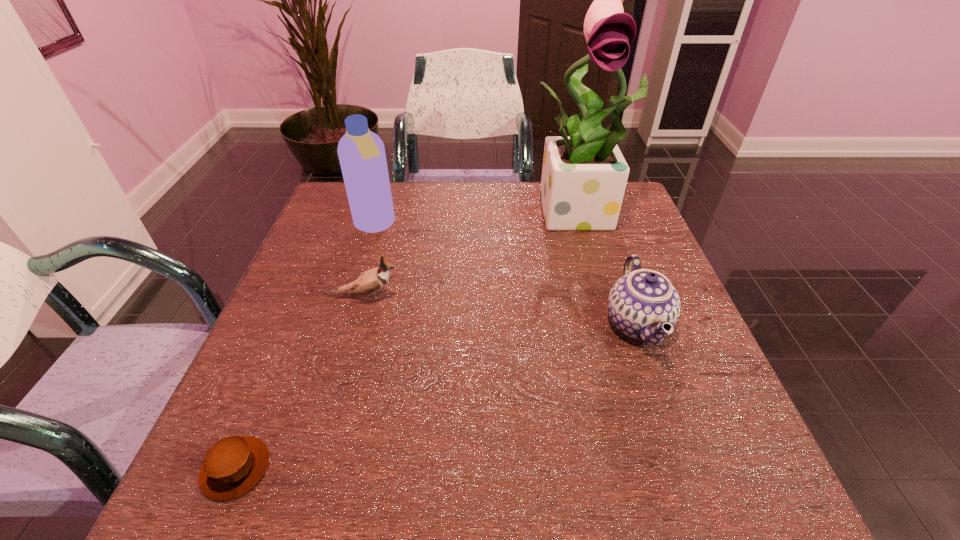
I want to click on free space located at the spout of the chinaware, so click(x=472, y=323).

What are the coordinates of `free space located at the face of the bird` in the screenshot? It's located at (578, 296).

Where is `free spot located on the back of the shortest object`? The height and width of the screenshot is (540, 960). free spot located on the back of the shortest object is located at coordinates (305, 300).

Identify the location of flower arrangement at the far edge. (584, 175).

I want to click on shampoo located in the far edge section of the desktop, so click(x=361, y=152).

Locate an element on the screen. This screenshot has width=960, height=540. object located in the near edge section of the desktop is located at coordinates (234, 465).

Locate an element on the screen. This screenshot has width=960, height=540. shampoo at the left edge is located at coordinates (361, 152).

You are a GUI agent. You are given a task and a screenshot of the screen. Output one action in this format:
    pyautogui.click(x=<x>, y=<y>)
    Task: Click on the bird located at the left edge
    
    Given the screenshot: What is the action you would take?
    pyautogui.click(x=372, y=280)

Locate an element on the screen. The width and height of the screenshot is (960, 540). muffin located at the left edge is located at coordinates (234, 465).

Where is `flower arrangement at the right edge`? The width and height of the screenshot is (960, 540). flower arrangement at the right edge is located at coordinates (584, 175).